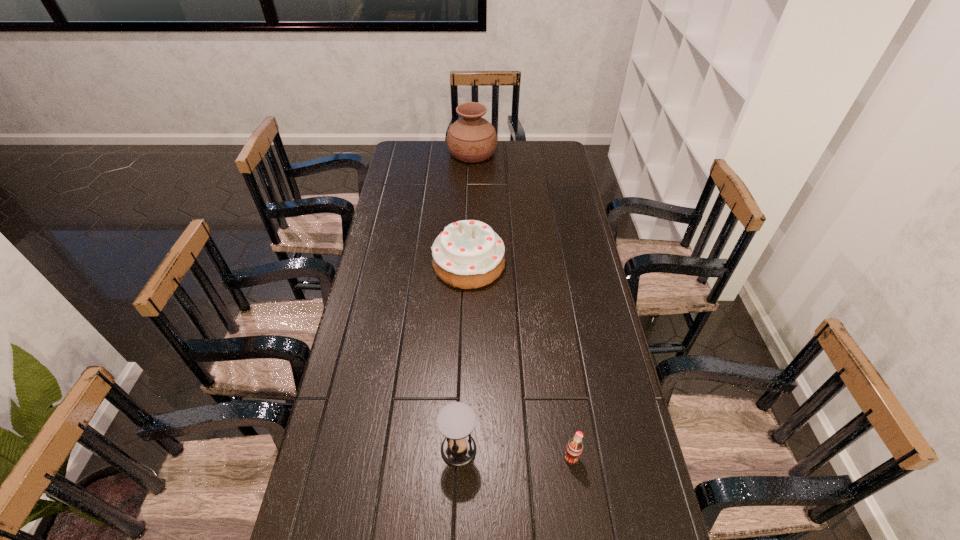
The height and width of the screenshot is (540, 960). Find the location of `blank region between the hourglass and the tallest object`. blank region between the hourglass and the tallest object is located at coordinates (466, 301).

Where is `free area in between the hourglass and the farthest object`? The image size is (960, 540). free area in between the hourglass and the farthest object is located at coordinates (466, 301).

Find the location of a particular element. This screenshot has height=540, width=960. object that is the third nearest to the farthest object is located at coordinates (574, 448).

Where is `the third closest object to the shortest object`? This screenshot has width=960, height=540. the third closest object to the shortest object is located at coordinates [x=471, y=139].

Find the location of `free location that satisfies the following two spatial constraints: 1. on the back side of the cake; 2. on the left side of the hourglass`. free location that satisfies the following two spatial constraints: 1. on the back side of the cake; 2. on the left side of the hourglass is located at coordinates (465, 264).

This screenshot has height=540, width=960. What are the coordinates of `vacant point that satisfies the following two spatial constraints: 1. on the back side of the farthest object; 2. on the left side of the hourglass` in the screenshot? It's located at (468, 153).